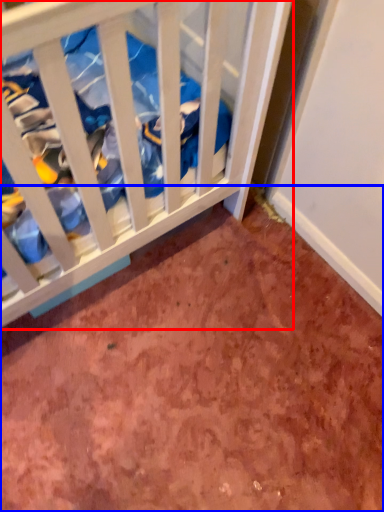
Question: Which of the following is the farthest to the observer, infant bed (highlighted by a red box) or dirt (highlighted by a blue box)?

Choices:
 (A) infant bed
 (B) dirt

Answer: (B)